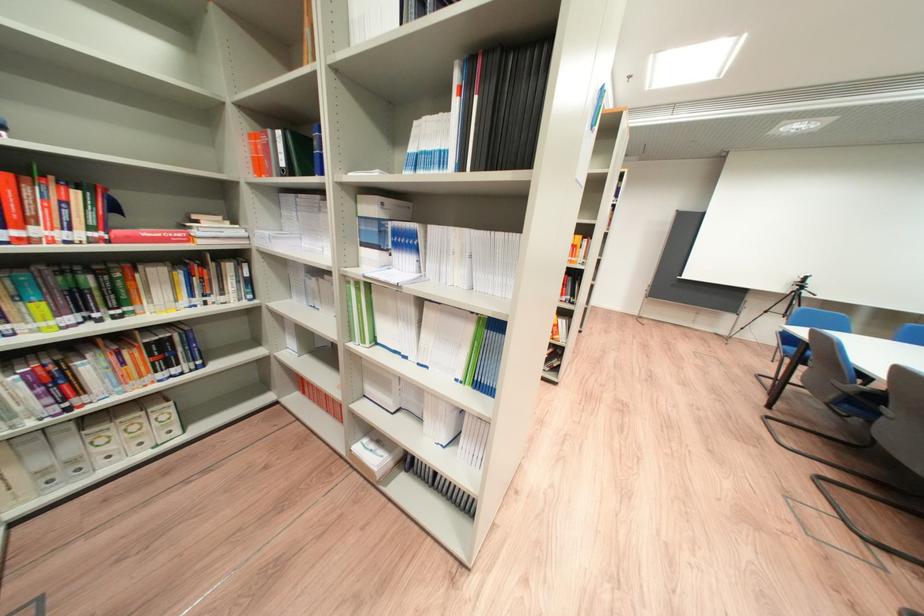
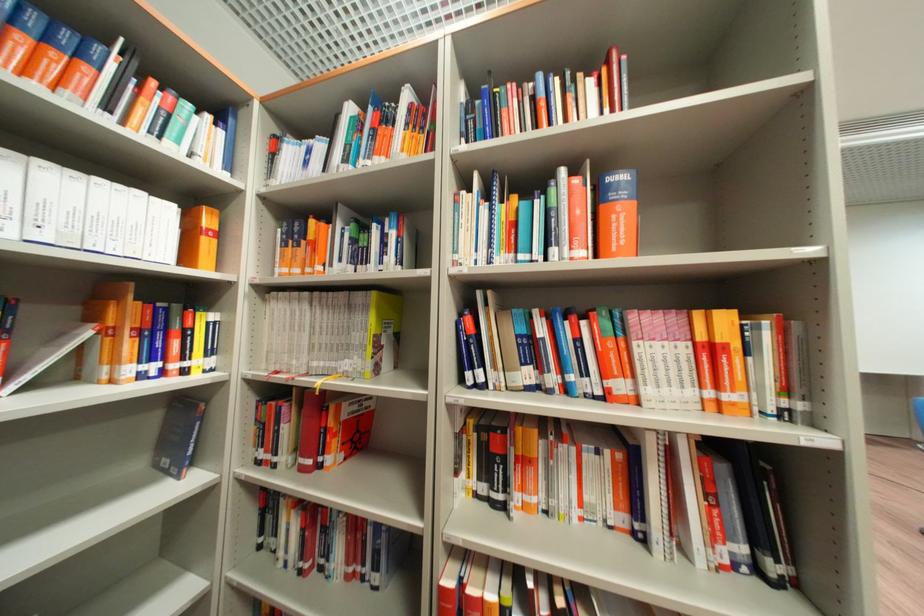
Locate, in the second image, the point that corresponds to (x=584, y=261) in the first image.

(739, 398)